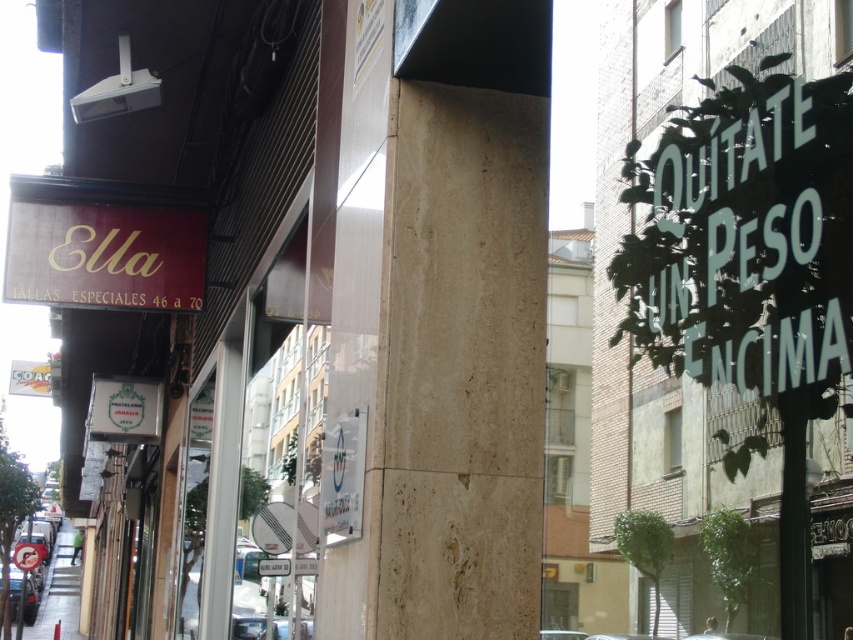
Question: Is beige travertine pillar at center smaller than maroon matte signboard at upper left?

Choices:
 (A) yes
 (B) no

Answer: (B)

Question: Does beige travertine pillar at center appear on the right side of maroon matte signboard at upper left?

Choices:
 (A) yes
 (B) no

Answer: (A)

Question: Which of the following is the closest to the observer?

Choices:
 (A) maroon matte signboard at upper left
 (B) beige travertine pillar at center

Answer: (B)

Question: Does beige travertine pillar at center appear under maroon matte signboard at upper left?

Choices:
 (A) yes
 (B) no

Answer: (A)